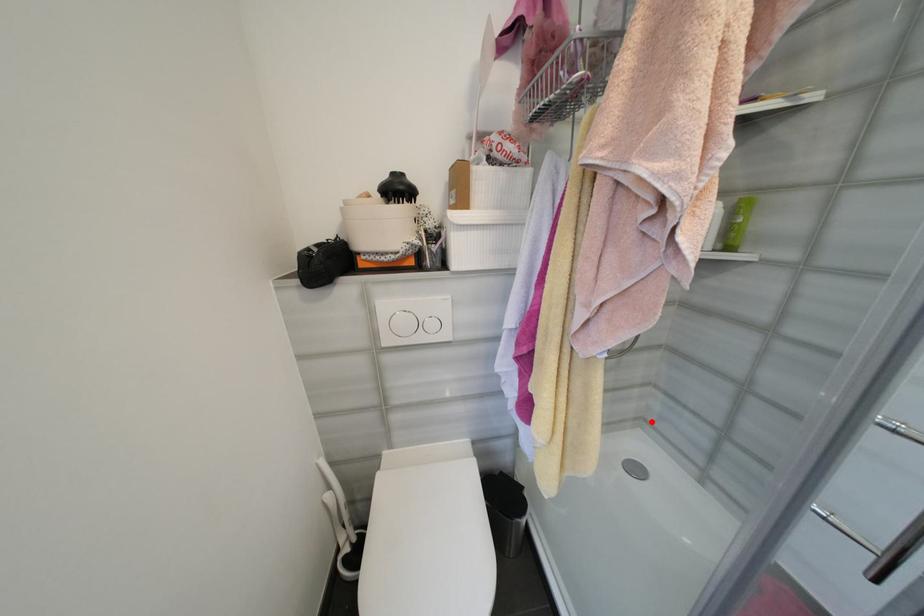
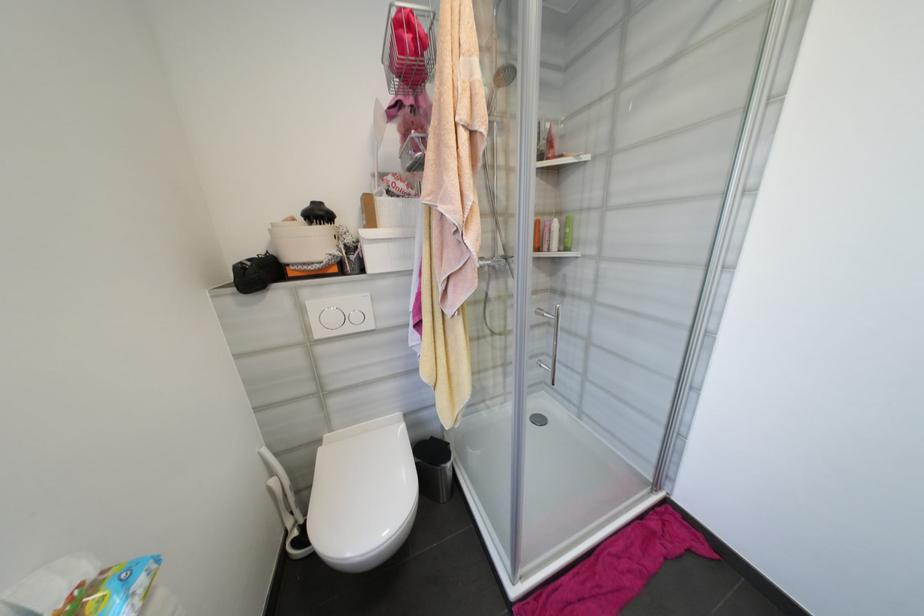
Question: I am providing you with two images of the same scene from different viewpoints. In image1, a red point is highlighted. Considering the same 3D point in image2, which of the following is correct?

Choices:
 (A) It is closer
 (B) It is farther

Answer: (B)